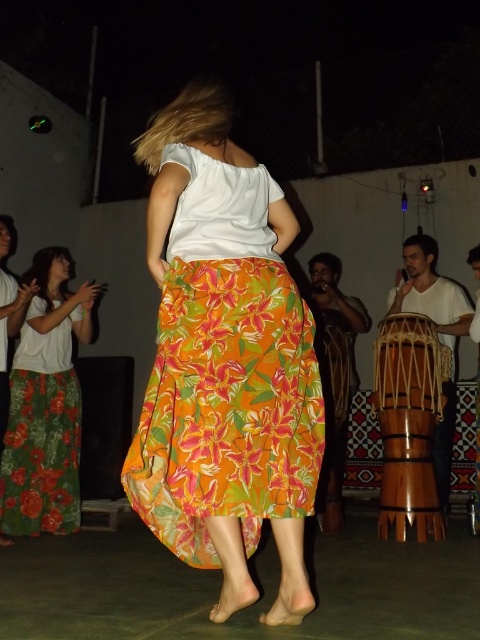
From the picture: Is the position of floral cotton skirt at center less distant than that of wooden drum at lower right?

Yes, it is in front of wooden drum at lower right.

Does point (277, 369) come in front of point (404, 381)?

Yes.

Is point (206, 212) more distant than point (394, 401)?

No, (206, 212) is in front of (394, 401).

This screenshot has height=640, width=480. I want to click on floral cotton skirt at center, so click(x=226, y=371).

Does floral cotton skirt at center appear over green floral skirt at left?

Yes, floral cotton skirt at center is above green floral skirt at left.

You are a GUI agent. You are given a task and a screenshot of the screen. Output one action in this format:
    pyautogui.click(x=<x>, y=<y>)
    Task: Click on the floral cotton skirt at center
    Image resolution: width=480 pixels, height=640 pixels.
    Given the screenshot: What is the action you would take?
    pyautogui.click(x=226, y=371)

Where is `floral cotton skirt at center`? This screenshot has height=640, width=480. floral cotton skirt at center is located at coordinates (226, 371).

How far apart are green floral skirt at left and wooden drum at lower right?

They are 6.41 feet apart.

Does green floral skirt at left appear under wooden drum at lower right?

No, green floral skirt at left is not below wooden drum at lower right.

Describe the element at coordinates (46, 404) in the screenshot. I see `green floral skirt at left` at that location.

At what (x,y) coordinates should I click in order to perform the action: click on green floral skirt at left. Please return your answer as a coordinate pair (x, y). This screenshot has height=640, width=480. Looking at the image, I should click on (46, 404).